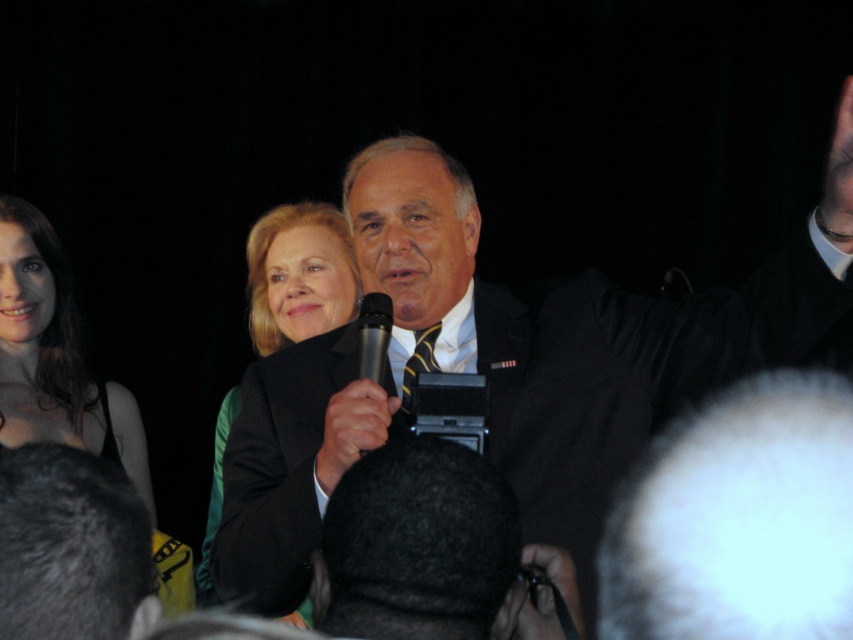
Can you confirm if black matte jacket at center is bigger than black metallic microphone at center?

Correct, black matte jacket at center is larger in size than black metallic microphone at center.

Which of these two, black matte jacket at center or black metallic microphone at center, stands shorter?

black metallic microphone at center

Is point (206, 568) behind point (367, 355)?

Yes, it is behind point (367, 355).

The image size is (853, 640). Find the location of `black matte jacket at center`. black matte jacket at center is located at coordinates 299,275.

Can you confirm if black suit at center is smaller than black metallic microphone at center?

No, black suit at center is not smaller than black metallic microphone at center.

Where is `black suit at center`? black suit at center is located at coordinates (578, 332).

Can you confirm if black suit at center is thinner than black matte microphone at center?

No.

Which of these two, black suit at center or black matte microphone at center, stands taller?

With more height is black suit at center.

Which is behind, point (265, 532) or point (335, 406)?

The point (265, 532) is more distant.

Where is `black suit at center`? The height and width of the screenshot is (640, 853). black suit at center is located at coordinates 578,332.